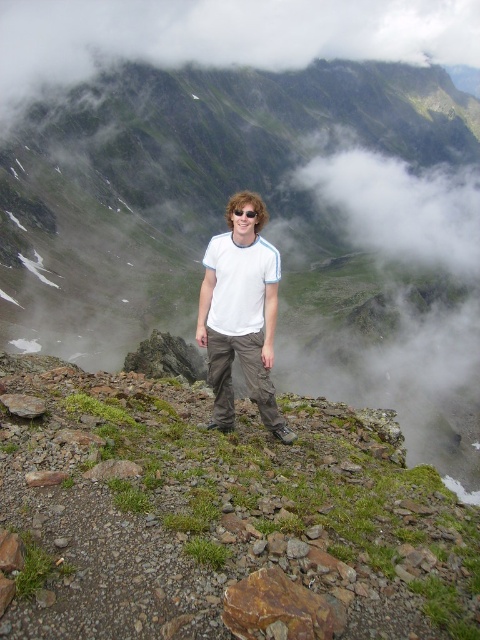
You are a hiker who wants to place a small flag on the highest green mossy rock in the scene. Which object should you choose between the green mossy rock at center and the green mossy rocks at center?

The green mossy rock at center is much taller than the green mossy rocks at center, so you should choose the green mossy rock at center to place the flag.

You are a photographer planning to take a photo of the person standing on the rocky outcrop. You want to ensure that both the point at coordinates point (71, 280) and point (240, 358) are in focus. Which point should you focus on first to ensure the closest object is sharp?

You should focus on point (71, 280) first because it is closer to the camera than point (240, 358), ensuring the nearest object is in sharp focus.

You are navigating a mountain trail and need to place two markers at the specified points. Given the coordinates provided, which point is positioned further away from the camera? Please select between point (421, 428) and point (475, 609).

Point (421, 428) is behind point (475, 609), so it is further away from the camera.